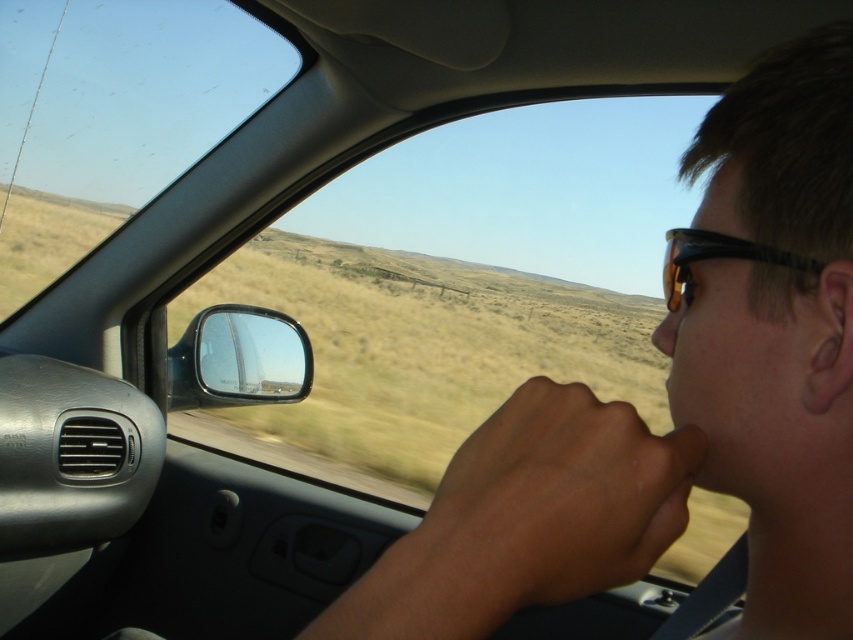
From the picture: You are sitting in the passenger seat of a car and notice two objects inside the vehicle. One is the glossy plastic side mirror at lower left and the other is the matte orange nose at center. Which object is positioned closer to the left side of the car?

The glossy plastic side mirror at lower left is positioned to the left of the matte orange nose at center, so it is closer to the left side of the car.

You are a passenger in a car and want to place both the tortoiseshell plastic goggles at right and the matte orange nose at center into a storage box that can hold items up to 1.5 inches in length. Can both items fit in the box if placed side by side?

The tortoiseshell plastic goggles at right and matte orange nose at center are 1.47 inches apart, so they can fit side by side in the storage box since their combined length is within the 1.5 inch limit.

Consider the image. You are a passenger in a car and want to check the side mirror and the nose of the car. Which object is taller, the glossy plastic side mirror at lower left or the matte orange nose at center?

The glossy plastic side mirror at lower left is much taller than the matte orange nose at center according to the description.